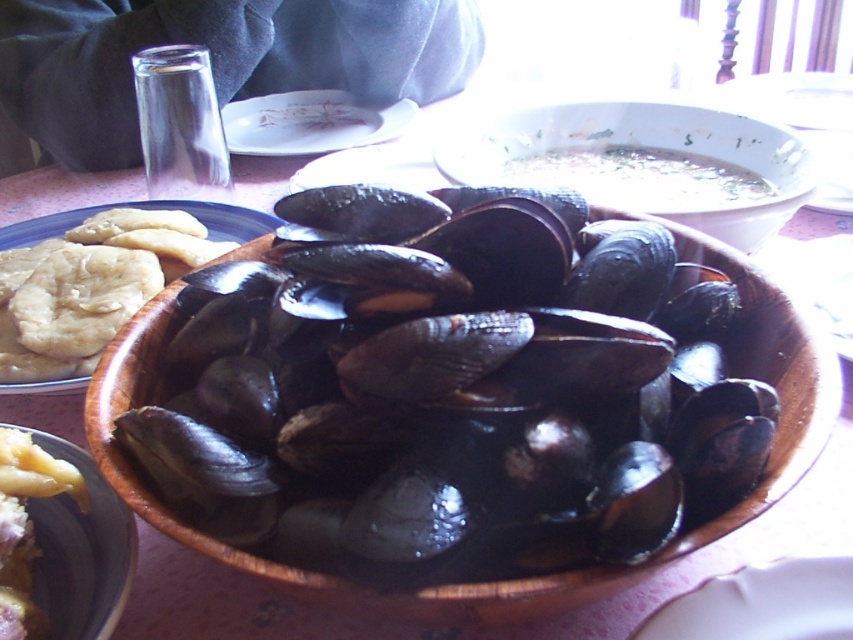
Question: Among these objects, which one is farthest from the camera?

Choices:
 (A) white glossy plate at upper center
 (B) translucent glass bowl at center

Answer: (A)

Question: Can you confirm if matte yellow flatbread at left is wider than matte ceramic bowl at center?

Choices:
 (A) no
 (B) yes

Answer: (B)

Question: Is shiny dark shellfish at center bigger than translucent glass bowl at center?

Choices:
 (A) no
 (B) yes

Answer: (A)

Question: In this image, where is shiny dark shellfish at center located relative to matte yellow flatbread at left?

Choices:
 (A) right
 (B) left

Answer: (A)

Question: Which is farther from the translucent glass bowl at center?

Choices:
 (A) shiny dark shellfish at center
 (B) matte yellow flatbread at left
 (C) matte ceramic bowl at center
 (D) white glossy plate at upper center

Answer: (C)

Question: Which of the following is the farthest from the observer?

Choices:
 (A) 100,230
 (B) 624,108
 (C) 344,108
 (D) 503,508

Answer: (C)